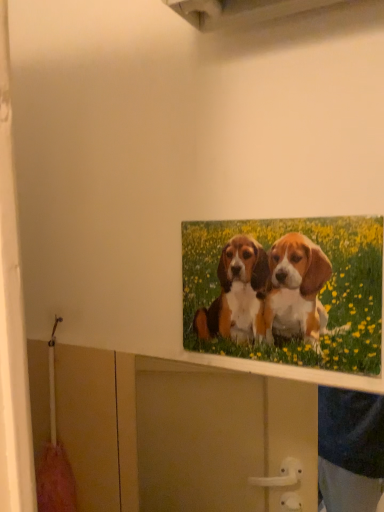
Question: From a real-world perspective, is printed canvas puppies at upper center positioned above or below matte white cabinet at upper center?

Choices:
 (A) below
 (B) above

Answer: (B)

Question: From the image's perspective, relative to matte white cabinet at upper center, is printed canvas puppies at upper center above or below?

Choices:
 (A) above
 (B) below

Answer: (A)

Question: From their relative heights in the image, would you say printed canvas puppies at upper center is taller or shorter than matte white cabinet at upper center?

Choices:
 (A) short
 (B) tall

Answer: (A)

Question: Is matte white cabinet at upper center in front of or behind printed canvas puppies at upper center in the image?

Choices:
 (A) behind
 (B) front

Answer: (B)

Question: Is matte white cabinet at upper center bigger or smaller than printed canvas puppies at upper center?

Choices:
 (A) small
 (B) big

Answer: (B)

Question: From the image's perspective, is matte white cabinet at upper center located above or below printed canvas puppies at upper center?

Choices:
 (A) below
 (B) above

Answer: (A)

Question: Is point (190, 425) positioned closer to the camera than point (375, 356)?

Choices:
 (A) farther
 (B) closer

Answer: (A)